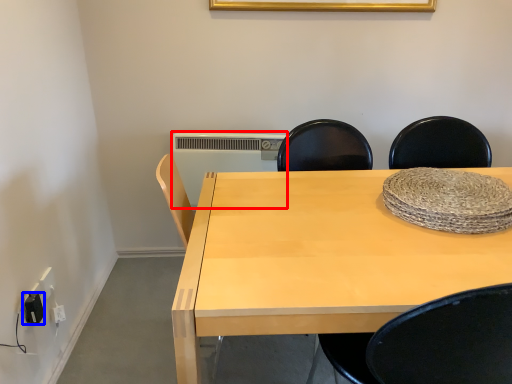
Question: Which point is closer to the camera, radiator (highlighted by a red box) or electric outlet (highlighted by a blue box)?

Choices:
 (A) radiator
 (B) electric outlet

Answer: (B)